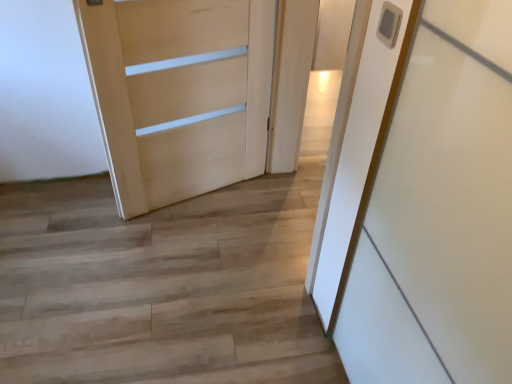
Locate an element on the screen. The image size is (512, 384). white glossy door at center, the second door positioned from the left is located at coordinates (290, 81).

Is wooden floor at center in front of light wood door at center, which appears as the 2th door when viewed from the right?

Yes, wooden floor at center is closer to the camera.

Is wooden floor at center oriented towards light wood door at center, which is the first door in left-to-right order?

No, wooden floor at center is not aimed at light wood door at center, which is the first door in left-to-right order.

From the image's perspective, is wooden floor at center on top of light wood door at center, which appears as the 2th door when viewed from the right?

Actually, wooden floor at center appears below light wood door at center, which appears as the 2th door when viewed from the right, in the image.

Could you measure the distance between wooden floor at center and light wood door at center, which appears as the 2th door when viewed from the right?

wooden floor at center is 21.02 inches away from light wood door at center, which appears as the 2th door when viewed from the right.

In the scene shown: Which of these two, light wood door at center, which appears as the 2th door when viewed from the right, or white glossy door at center, the 1th door positioned from the right, stands shorter?

With less height is white glossy door at center, the 1th door positioned from the right.

Is light wood door at center, which appears as the 2th door when viewed from the right, not inside white glossy door at center, the 1th door positioned from the right?

light wood door at center, which appears as the 2th door when viewed from the right, lies outside white glossy door at center, the 1th door positioned from the right,'s area.

Does light wood door at center, which is the first door in left-to-right order, appear on the right side of white glossy door at center, the second door positioned from the left?

Incorrect, light wood door at center, which is the first door in left-to-right order, is not on the right side of white glossy door at center, the second door positioned from the left.

Who is bigger, light wood door at center, which appears as the 2th door when viewed from the right, or white glossy door at center, the second door positioned from the left?

light wood door at center, which appears as the 2th door when viewed from the right.

You are a GUI agent. You are given a task and a screenshot of the screen. Output one action in this format:
    pyautogui.click(x=<x>, y=<y>)
    Task: Click on the door in front of the white glossy door at center, the 1th door positioned from the right
    This screenshot has height=384, width=512.
    Given the screenshot: What is the action you would take?
    pyautogui.click(x=179, y=94)

Which is correct: white glossy door at center, the 1th door positioned from the right, is inside light wood door at center, which appears as the 2th door when viewed from the right, or outside of it?

white glossy door at center, the 1th door positioned from the right, cannot be found inside light wood door at center, which appears as the 2th door when viewed from the right.

From a real-world perspective, is white glossy door at center, the 1th door positioned from the right, on light wood door at center, which is the first door in left-to-right order?

No.

The width and height of the screenshot is (512, 384). In order to click on stairwell on the left of white glossy door at center, the 1th door positioned from the right in this screenshot , I will do `click(161, 286)`.

Is wooden floor at center smaller than white glossy door at center, the 1th door positioned from the right?

No, wooden floor at center is not smaller than white glossy door at center, the 1th door positioned from the right.

Which is closer to the camera, (34, 244) or (298, 139)?

Point (34, 244) is closer to the camera than point (298, 139).

Which point is more forward, [183,68] or [170,237]?

The point [183,68] is in front.

In the scene shown: From the image's perspective, which one is positioned lower, light wood door at center, which is the first door in left-to-right order, or wooden floor at center?

From the image's view, wooden floor at center is below.

Is light wood door at center, which appears as the 2th door when viewed from the right, facing away from wooden floor at center?

No, light wood door at center, which appears as the 2th door when viewed from the right, is not facing away from wooden floor at center.

Which is correct: light wood door at center, which is the first door in left-to-right order, is inside wooden floor at center, or outside of it?

light wood door at center, which is the first door in left-to-right order, is not enclosed by wooden floor at center.

Between point (301, 80) and point (94, 379), which one is positioned behind?

Point (301, 80)

From a real-world perspective, between white glossy door at center, the second door positioned from the left, and wooden floor at center, who is vertically lower?

wooden floor at center.

Is white glossy door at center, the second door positioned from the left, outside of wooden floor at center?

Yes, white glossy door at center, the second door positioned from the left, is not within wooden floor at center.

Can you confirm if white glossy door at center, the second door positioned from the left, is positioned to the right of wooden floor at center?

Correct, you'll find white glossy door at center, the second door positioned from the left, to the right of wooden floor at center.

Starting from the wooden floor at center, which door is the 1st one to the right? Please provide its 2D coordinates.

[(179, 94)]

The image size is (512, 384). Find the location of `door behind the light wood door at center, which is the first door in left-to-right order`. door behind the light wood door at center, which is the first door in left-to-right order is located at coordinates (290, 81).

From the image, which object appears to be nearer to wooden floor at center, light wood door at center, which is the first door in left-to-right order, or white glossy door at center, the 1th door positioned from the right?

light wood door at center, which is the first door in left-to-right order, is closer to wooden floor at center.

From the image, which object appears to be nearer to white glossy door at center, the 1th door positioned from the right, wooden floor at center or light wood door at center, which appears as the 2th door when viewed from the right?

Among the two, light wood door at center, which appears as the 2th door when viewed from the right, is located nearer to white glossy door at center, the 1th door positioned from the right.

Estimate the real-world distances between objects in this image. Which object is further from white glossy door at center, the 1th door positioned from the right, light wood door at center, which appears as the 2th door when viewed from the right, or wooden floor at center?

Based on the image, wooden floor at center appears to be further to white glossy door at center, the 1th door positioned from the right.

Which object lies further to the anchor point light wood door at center, which appears as the 2th door when viewed from the right, white glossy door at center, the second door positioned from the left, or wooden floor at center?

Based on the image, wooden floor at center appears to be further to light wood door at center, which appears as the 2th door when viewed from the right.

When comparing their distances from light wood door at center, which appears as the 2th door when viewed from the right, does wooden floor at center or white glossy door at center, the 1th door positioned from the right, seem closer?

white glossy door at center, the 1th door positioned from the right, lies closer to light wood door at center, which appears as the 2th door when viewed from the right, than the other object.

Based on their spatial positions, is white glossy door at center, the second door positioned from the left, or light wood door at center, which appears as the 2th door when viewed from the right, closer to wooden floor at center?

Based on the image, light wood door at center, which appears as the 2th door when viewed from the right, appears to be nearer to wooden floor at center.

I want to click on door between white glossy door at center, the second door positioned from the left, and wooden floor at center, in the vertical direction, so click(x=179, y=94).